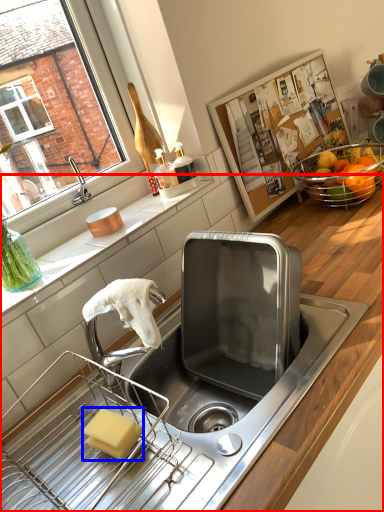
Question: Among these objects, which one is farthest to the camera, countertop (highlighted by a red box) or soap (highlighted by a blue box)?

Choices:
 (A) countertop
 (B) soap

Answer: (B)